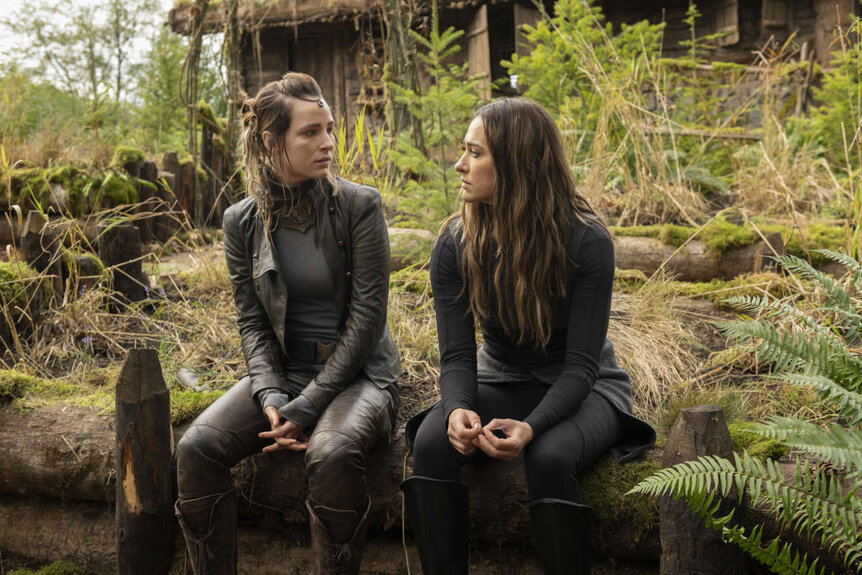
Find the location of `door`. door is located at coordinates (486, 61).